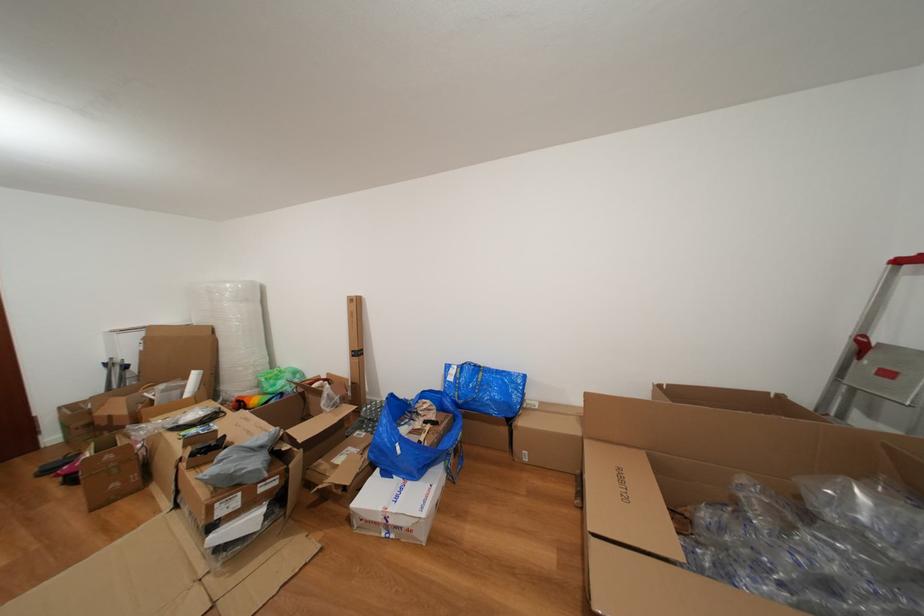
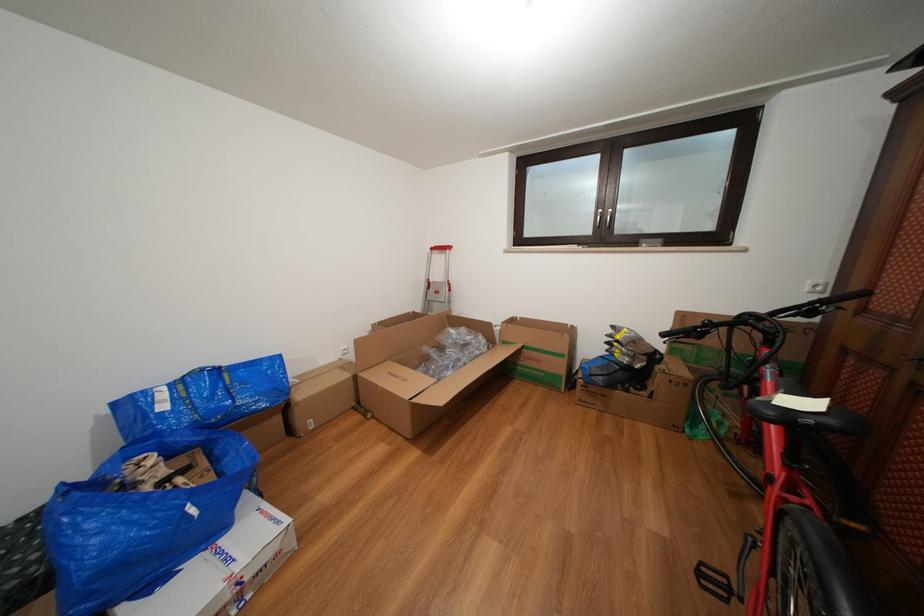
Where in the second image is the point corresponding to the point at 529,426 from the first image?

(309, 400)